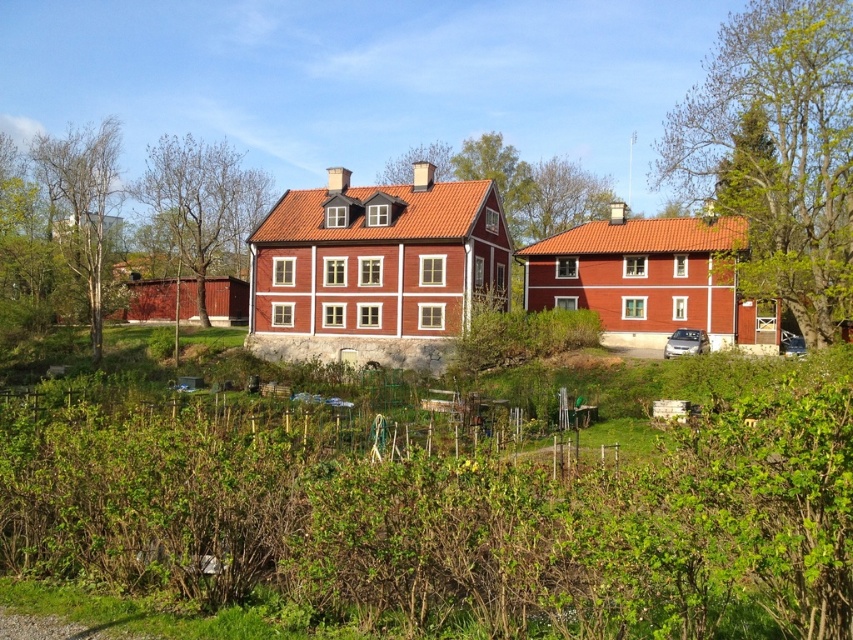
You are standing at the gravel path in front of the houses. You see a bare wood tree at left and a green leafy tree at left. Which one is closer to the ground?

The bare wood tree at left is located below green leafy tree at left, so the bare wood tree at left is closer to the ground.

You are standing at the gravel path in front of the two houses. You notice two green leafy trees in the garden. Which tree is closer to you, the green leafy tree at upper right or the green leafy tree at upper center?

The green leafy tree at upper right is closer to the viewer than the green leafy tree at upper center.

You are standing at the entrance of the larger house on the left and want to walk to the smaller house on the right. There are two points marked on the path. One is at coordinates point (798, 52) and the other at point (564, 160). Which point should you step on first to reach the smaller house on the right?

You should step on point (798, 52) first because it is in front of point (564, 160) along the path leading to the smaller house on the right.